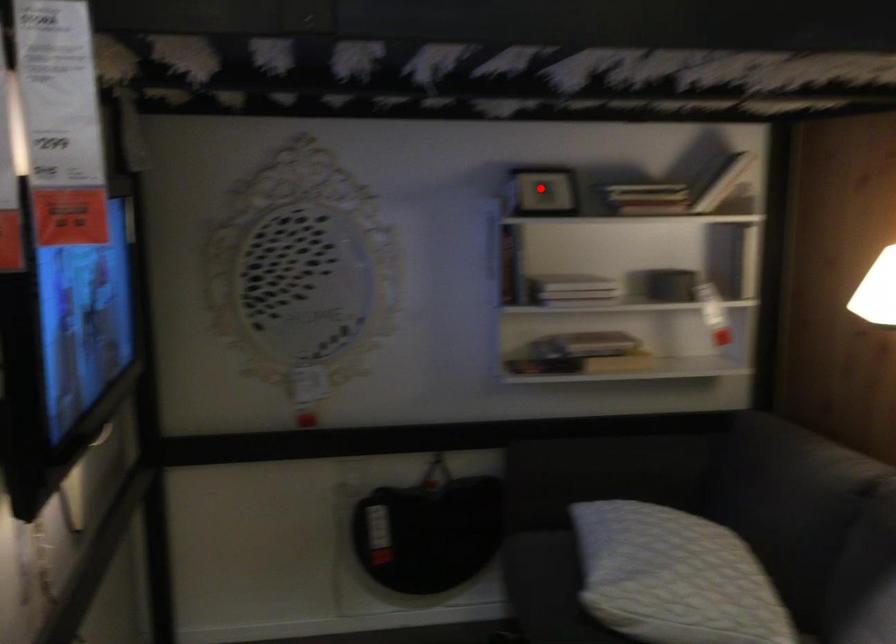
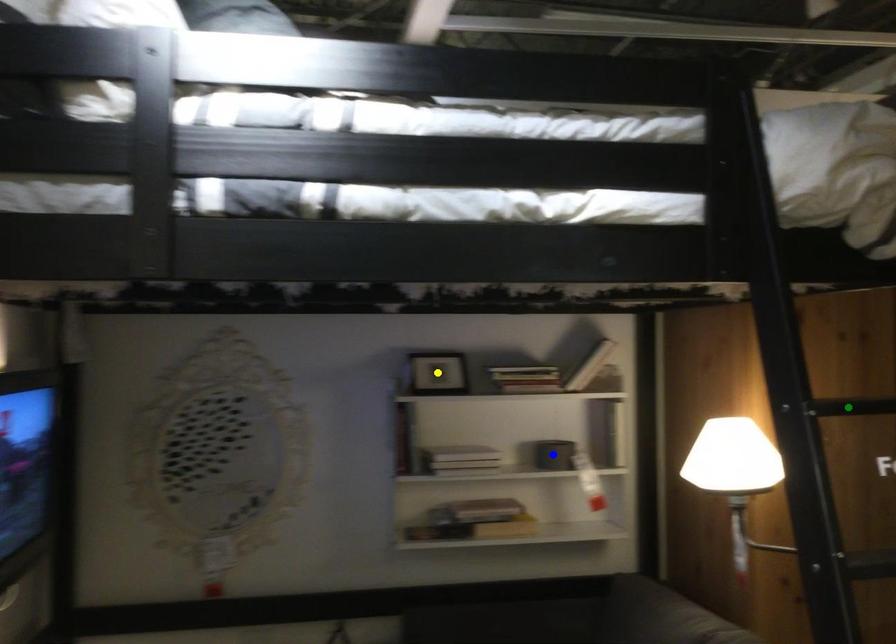
Question: I am providing you with two images of the same scene from different viewpoints. A red point is marked on the first image. You are given multiple points on the second image. Which point in image 2 is actually the same real-world point as the red point in image 1?

Choices:
 (A) yellow point
 (B) blue point
 (C) green point

Answer: (A)